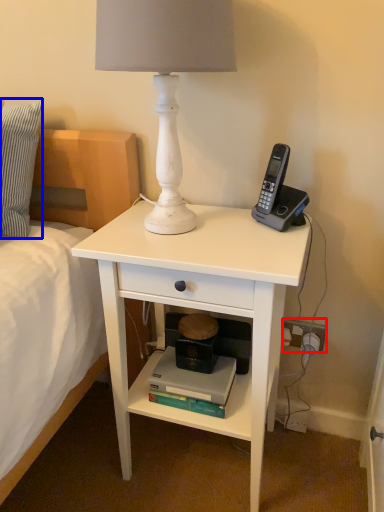
Question: Which object is further to the camera taking this photo, power outlet (highlighted by a red box) or pillow (highlighted by a blue box)?

Choices:
 (A) power outlet
 (B) pillow

Answer: (A)